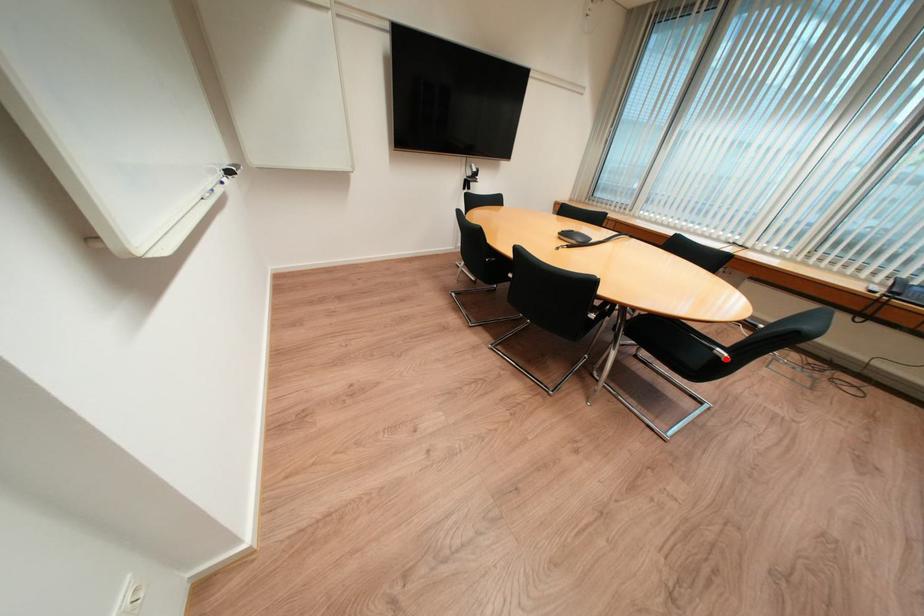
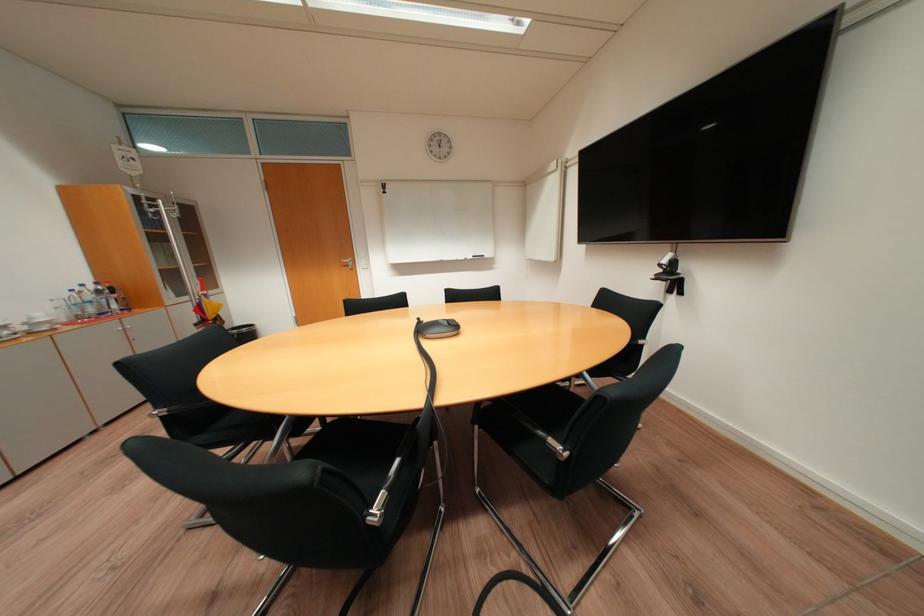
Question: I am providing you with two images of the same scene from different viewpoints. A red point is marked on the first image. Is the red point's position out of view in image 2?

Choices:
 (A) Yes
 (B) No

Answer: (A)